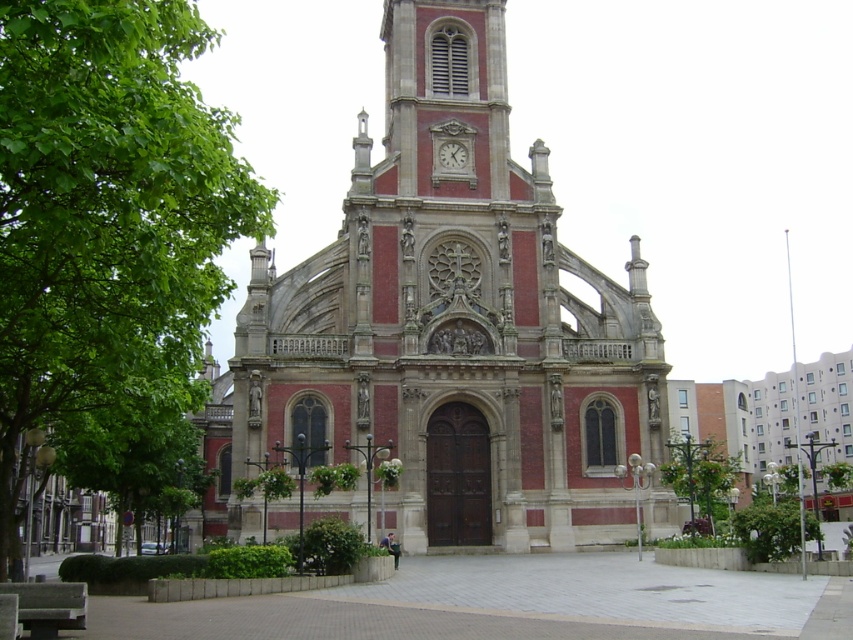
Based on the photo, is red brick church at center to the right of green leafy tree at left from the viewer's perspective?

Yes, red brick church at center is to the right of green leafy tree at left.

Does point (287, 298) come farther from viewer compared to point (114, 416)?

Yes.

Is point (373, 173) more distant than point (165, 349)?

Yes, it is behind point (165, 349).

Locate an element on the screen. The height and width of the screenshot is (640, 853). red brick church at center is located at coordinates (454, 324).

Can you confirm if red brick church at center is positioned above white marble clock at upper center?

Incorrect, red brick church at center is not positioned above white marble clock at upper center.

What do you see at coordinates (454, 324) in the screenshot? I see `red brick church at center` at bounding box center [454, 324].

Which is behind, point (556, 352) or point (450, 145)?

The point (450, 145) is behind.

Locate an element on the screen. The height and width of the screenshot is (640, 853). red brick church at center is located at coordinates (454, 324).

Between green leafy tree at center and white marble clock at upper center, which one appears on the left side from the viewer's perspective?

white marble clock at upper center is more to the left.

Which of these two, green leafy tree at center or white marble clock at upper center, stands shorter?

Standing shorter between the two is white marble clock at upper center.

Which is in front, point (659, 467) or point (445, 164)?

Positioned in front is point (659, 467).

Locate an element on the screen. The height and width of the screenshot is (640, 853). green leafy tree at center is located at coordinates (699, 477).